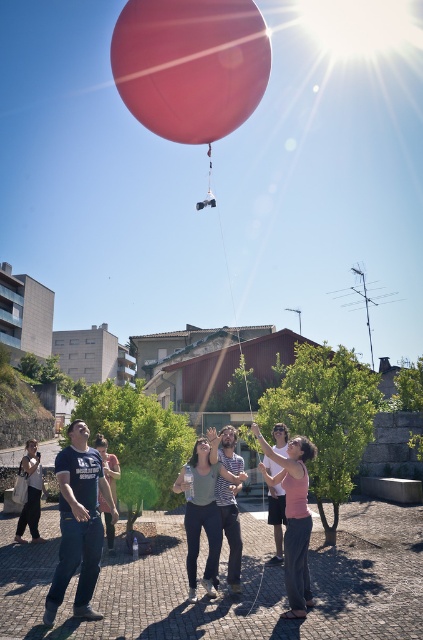
Can you confirm if pink matte shirt at center is positioned to the left of matte black t-shirt at lower left?

No, pink matte shirt at center is not to the left of matte black t-shirt at lower left.

Which is more to the right, pink matte shirt at center or matte black t-shirt at lower left?

pink matte shirt at center is more to the right.

Does point (297, 449) come in front of point (19, 525)?

That is True.

Where is `pink matte shirt at center`? This screenshot has width=423, height=640. pink matte shirt at center is located at coordinates (293, 516).

Is matte black t-shirt at lower left thinner than matte white shirt at center?

In fact, matte black t-shirt at lower left might be wider than matte white shirt at center.

Is matte black t-shirt at lower left in front of matte white shirt at center?

No, matte black t-shirt at lower left is further to the viewer.

The height and width of the screenshot is (640, 423). Describe the element at coordinates (30, 493) in the screenshot. I see `matte black t-shirt at lower left` at that location.

Locate an element on the screen. The width and height of the screenshot is (423, 640). matte black t-shirt at lower left is located at coordinates pos(30,493).

Which of these two, striped shirt at center or matte black t-shirt at lower left, stands taller?

With more height is matte black t-shirt at lower left.

Can you confirm if striped shirt at center is positioned to the right of matte black t-shirt at lower left?

Correct, you'll find striped shirt at center to the right of matte black t-shirt at lower left.

Is point (238, 461) positioned after point (24, 506)?

No, it is in front of (24, 506).

Locate an element on the screen. This screenshot has height=640, width=423. striped shirt at center is located at coordinates (230, 528).